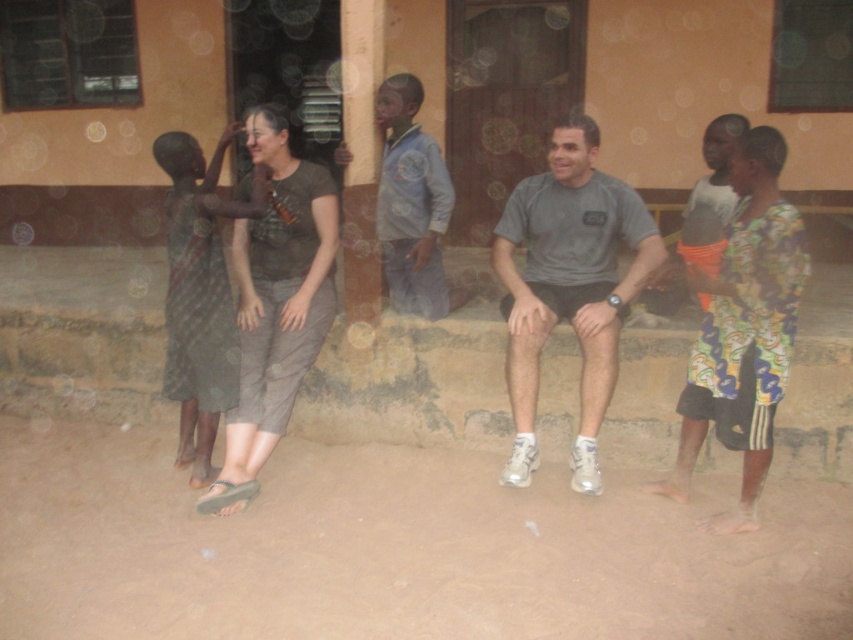
Is gray matte t-shirt at center bigger than brown cotton shirt at center?

Yes, gray matte t-shirt at center is bigger than brown cotton shirt at center.

Does gray matte t-shirt at center have a lesser width compared to brown cotton shirt at center?

In fact, gray matte t-shirt at center might be wider than brown cotton shirt at center.

The image size is (853, 640). Find the location of `gray matte t-shirt at center`. gray matte t-shirt at center is located at coordinates (567, 285).

Between point (761, 307) and point (224, 408), which one is positioned behind?

Positioned behind is point (224, 408).

Who is positioned more to the right, printed fabric dress at right or dark gray fabric dress at left?

Positioned to the right is printed fabric dress at right.

This screenshot has width=853, height=640. I want to click on printed fabric dress at right, so click(x=743, y=330).

Who is more distant from viewer, (752, 317) or (271, 340)?

Point (271, 340)

Who is shorter, printed fabric dress at right or brown cotton shirt at center?

Standing shorter between the two is printed fabric dress at right.

Describe the element at coordinates (743, 330) in the screenshot. The width and height of the screenshot is (853, 640). I see `printed fabric dress at right` at that location.

Where is `printed fabric dress at right`? printed fabric dress at right is located at coordinates (743, 330).